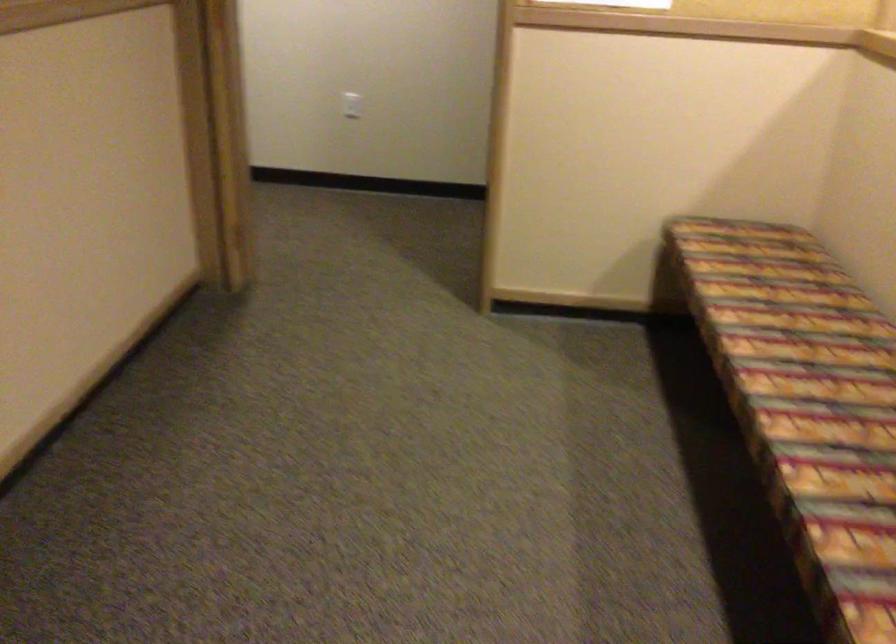
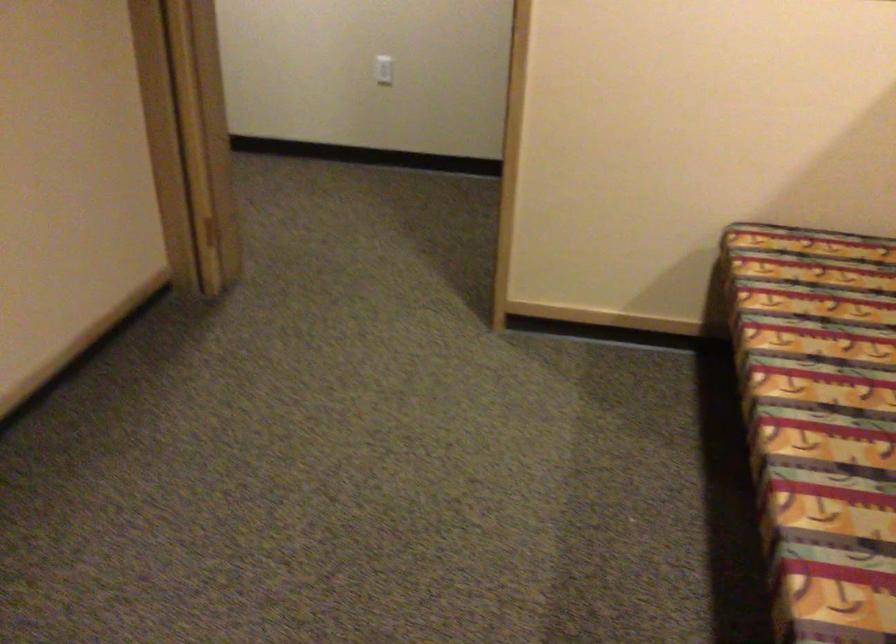
Question: Based on the continuous images, in which direction is the camera rotating? Reply with the corresponding letter.

Choices:
 (A) Left
 (B) Right
 (C) Up
 (D) Down

Answer: (A)